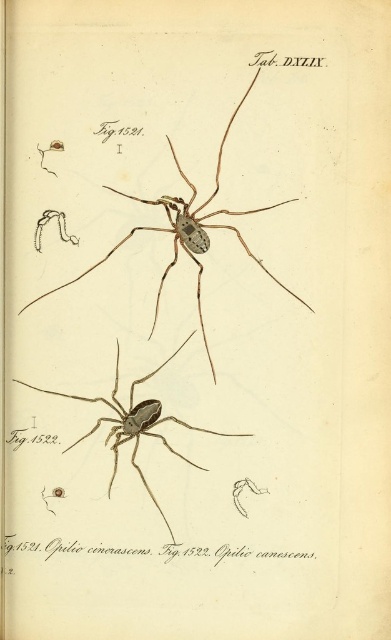
Can you confirm if translucent brown spider at upper center is bigger than matte black spider at center?

Yes.

Between point (114, 188) and point (152, 426), which one is positioned in front?

Positioned in front is point (114, 188).

At what (x,y) coordinates should I click in order to perform the action: click on translucent brown spider at upper center. Please return your answer as a coordinate pair (x, y). Looking at the image, I should click on (188, 230).